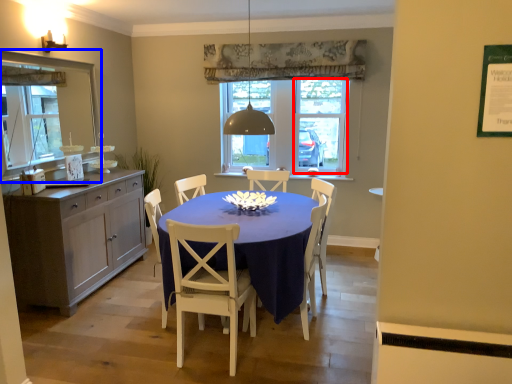
Question: Which object appears closest to the camera in this image, glass door (highlighted by a red box) or mirror (highlighted by a blue box)?

Choices:
 (A) glass door
 (B) mirror

Answer: (B)